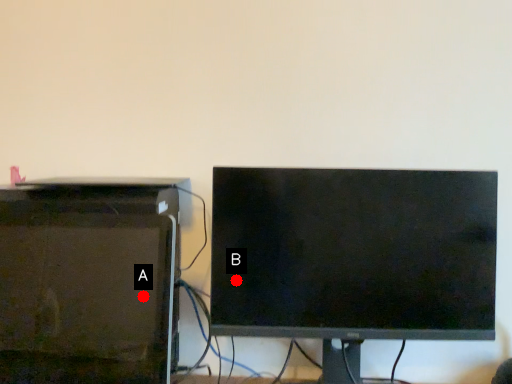
Question: Two points are circled on the image, labeled by A and B beside each circle. Which point appears farthest from the camera in this image?

Choices:
 (A) A is further
 (B) B is further

Answer: (B)